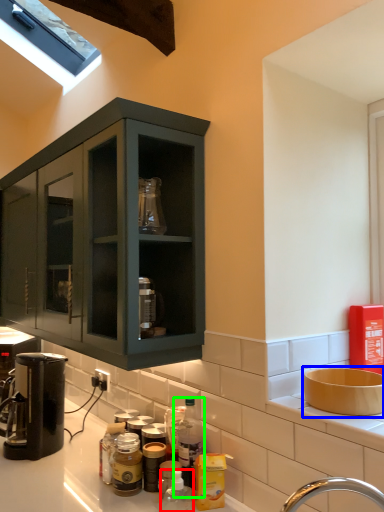
Question: Which is nearer to the bottle (highlighted by a red box)? sink (highlighted by a blue box) or bottle (highlighted by a green box).

Choices:
 (A) sink
 (B) bottle

Answer: (B)